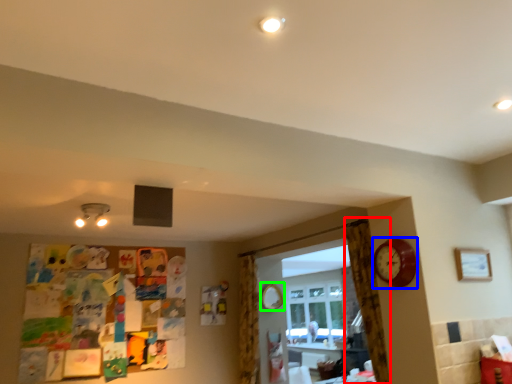
Question: Which is nearer to the curtain (highlighted by a red box)? clock (highlighted by a blue box) or mirror (highlighted by a green box).

Choices:
 (A) clock
 (B) mirror

Answer: (A)